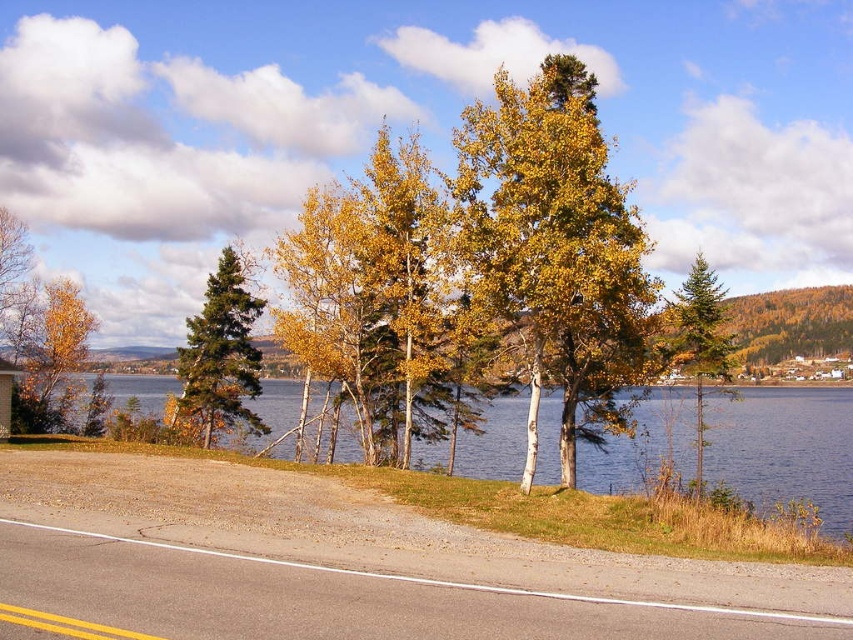
What do you see at coordinates (784, 448) in the screenshot?
I see `blue water at center` at bounding box center [784, 448].

Does blue water at center have a greater height compared to green matte evergreen tree at right?

In fact, blue water at center may be shorter than green matte evergreen tree at right.

Is point (743, 449) closer to viewer compared to point (694, 296)?

No, it is behind (694, 296).

Identify the location of blue water at center. point(784,448).

The height and width of the screenshot is (640, 853). Find the location of `green glossy pine tree at left`. green glossy pine tree at left is located at coordinates (221, 353).

Does green glossy pine tree at left appear on the right side of golden yellow leaves at left?

Yes, green glossy pine tree at left is to the right of golden yellow leaves at left.

Does point (219, 272) come in front of point (39, 317)?

Yes, it is in front of point (39, 317).

Locate an element on the screen. The width and height of the screenshot is (853, 640). green glossy pine tree at left is located at coordinates (221, 353).

Can you confirm if yellow-green leaves at center is positioned to the left of golden yellow leaves at left?

In fact, yellow-green leaves at center is to the right of golden yellow leaves at left.

The image size is (853, 640). What do you see at coordinates (553, 250) in the screenshot?
I see `yellow-green leaves at center` at bounding box center [553, 250].

Identify the location of yellow-green leaves at center. (553, 250).